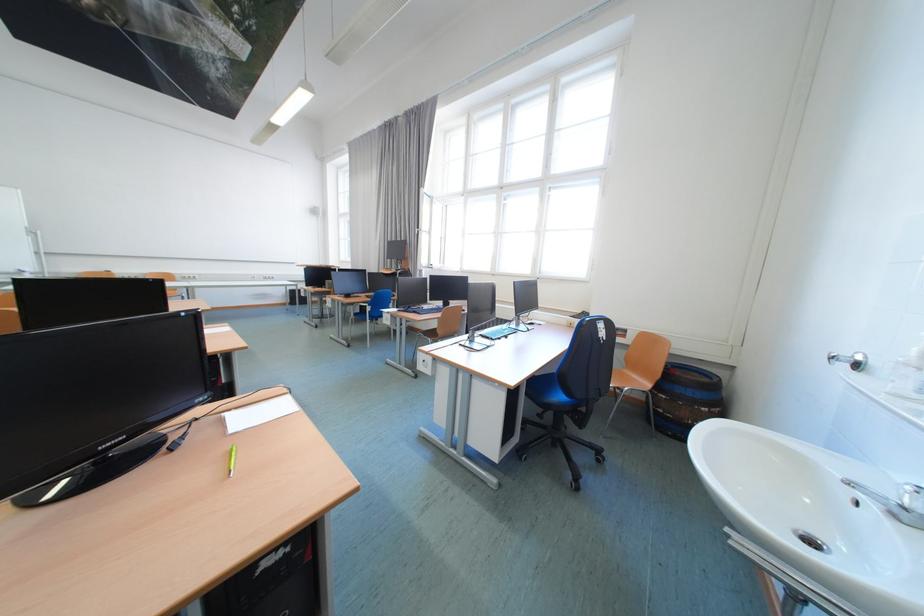
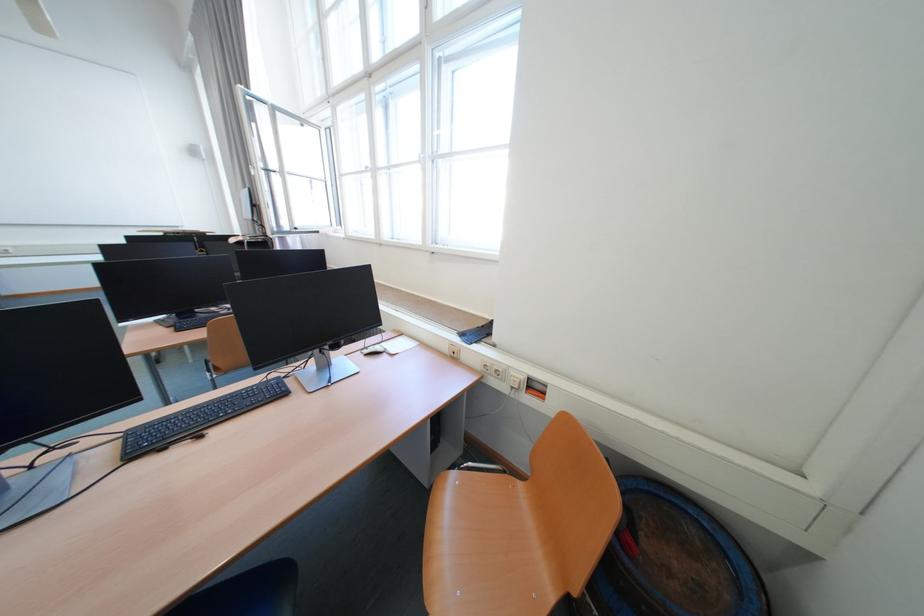
In a continuous first-person perspective shot, in which direction is the camera moving?

The movement direction of the cameraman is right, forward.